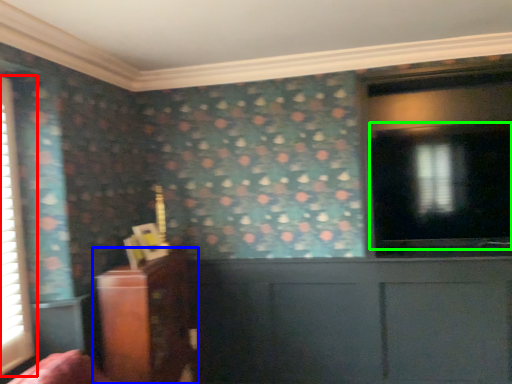
Question: Considering the real-world distances, which object is closest to window (highlighted by a red box)? furniture (highlighted by a blue box) or window screen (highlighted by a green box).

Choices:
 (A) furniture
 (B) window screen

Answer: (A)